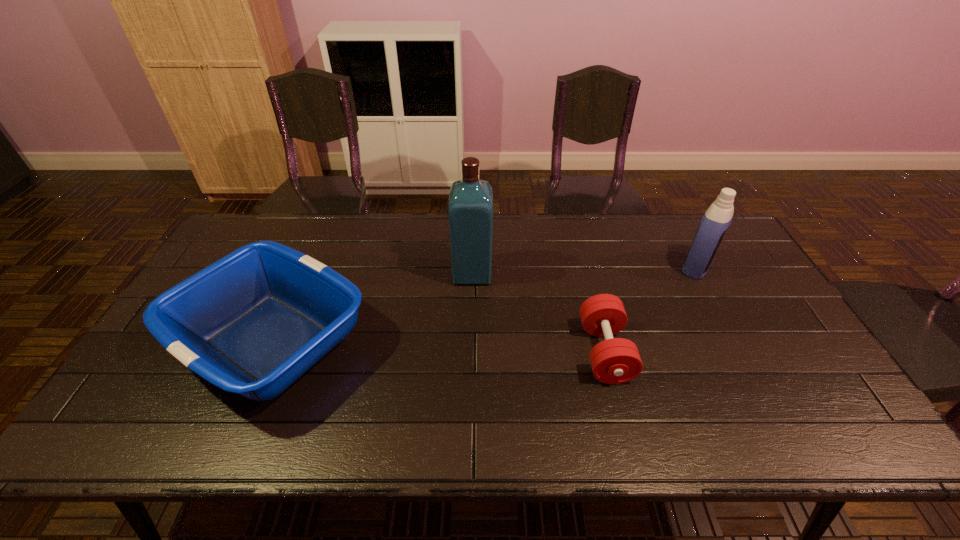
Where is `vacant space at the right edge of the desktop`? This screenshot has width=960, height=540. vacant space at the right edge of the desktop is located at coordinates (734, 281).

Where is `free space between the third object from left to right and the tallest object`? Image resolution: width=960 pixels, height=540 pixels. free space between the third object from left to right and the tallest object is located at coordinates (539, 313).

At what (x,y) coordinates should I click in order to perform the action: click on vacant region between the leftmost object and the second object from left to right. Please return your answer as a coordinate pair (x, y). The width and height of the screenshot is (960, 540). Looking at the image, I should click on (372, 307).

Where is `free space that is in between the tray and the third shortest object`? free space that is in between the tray and the third shortest object is located at coordinates (485, 304).

Locate an element on the screen. This screenshot has width=960, height=540. empty location between the leftmost object and the tallest object is located at coordinates (372, 307).

I want to click on free space between the third tallest object and the detergent, so click(485, 304).

Identify the location of vacant area that lies between the detergent and the liquor. The width and height of the screenshot is (960, 540). (585, 270).

The image size is (960, 540). I want to click on free spot between the third tallest object and the third object from left to right, so click(x=439, y=347).

Where is `free point between the third object from right to left and the leftmost object`? free point between the third object from right to left and the leftmost object is located at coordinates 372,307.

Image resolution: width=960 pixels, height=540 pixels. Identify the location of empty location between the leftmost object and the shortest object. (439, 347).